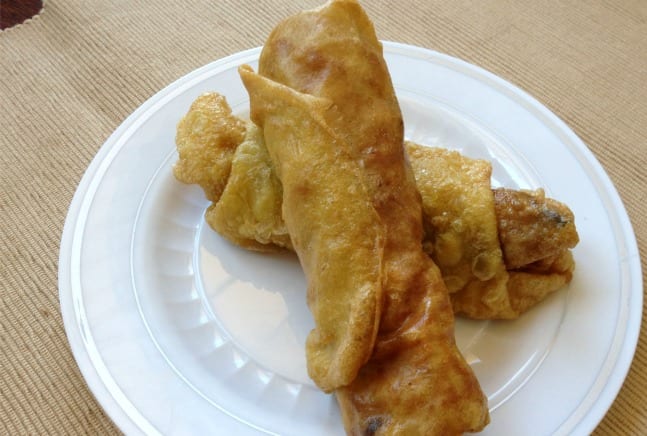
This screenshot has width=647, height=436. I want to click on white plate, so click(x=158, y=318).